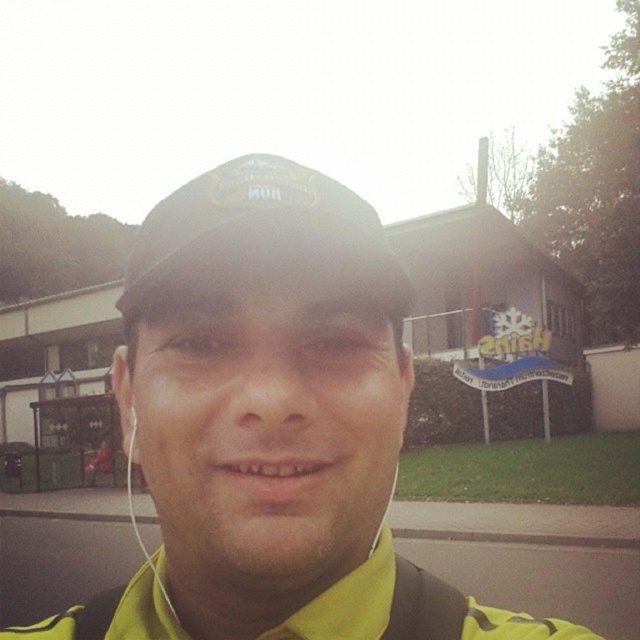
Question: Which of the following is the closest to the observer?

Choices:
 (A) black fabric cap at center
 (B) white earphone at left

Answer: (A)

Question: Which point appears closest to the camera in this image?

Choices:
 (A) (364, 296)
 (B) (333, 195)

Answer: (B)

Question: Which object is positioned closest to the black fabric cap at center?

Choices:
 (A) yellow matte jacket at center
 (B) white earphone at left

Answer: (A)

Question: Where is yellow matte jacket at center located in relation to black fabric cap at center in the image?

Choices:
 (A) above
 (B) below

Answer: (B)

Question: Is black fabric cap at center wider than white earphone at left?

Choices:
 (A) no
 (B) yes

Answer: (B)

Question: Can you confirm if black fabric cap at center is wider than white earphone at left?

Choices:
 (A) no
 (B) yes

Answer: (B)